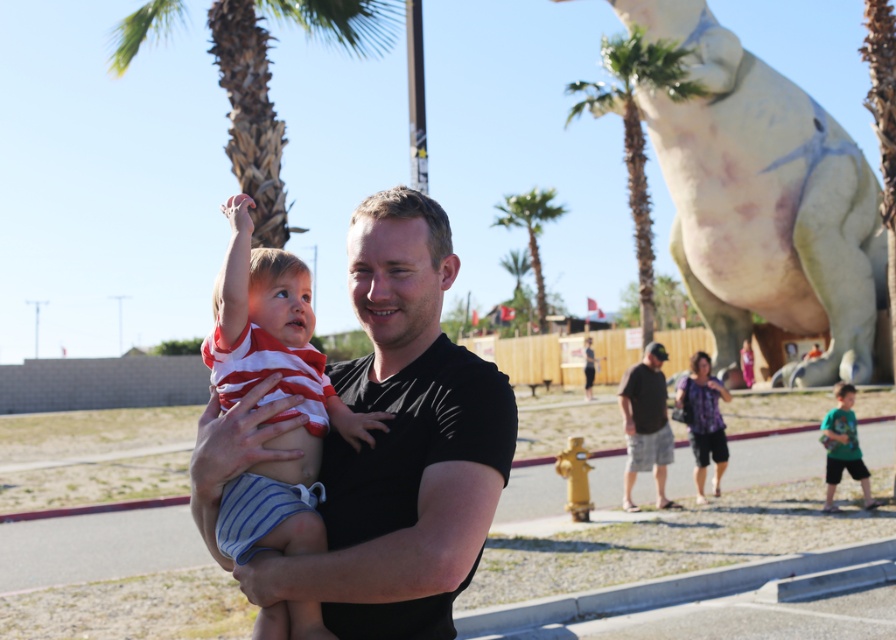
Can you confirm if green leafy palm tree at upper center is bigger than black cotton shirt at center?

Indeed, green leafy palm tree at upper center has a larger size compared to black cotton shirt at center.

In the scene shown: Between green leafy palm tree at upper center and black cotton shirt at center, which one appears on the right side from the viewer's perspective?

Positioned to the right is black cotton shirt at center.

Is point (314, 19) positioned in front of point (627, 440)?

Yes, it is in front of point (627, 440).

This screenshot has height=640, width=896. I want to click on green leafy palm tree at upper center, so click(x=268, y=88).

How distant is green leafy palm tree at upper right from green jersey at lower right?

green leafy palm tree at upper right is 27.05 meters away from green jersey at lower right.

Which is in front, point (591, 93) or point (837, 456)?

Point (837, 456) is in front.

The width and height of the screenshot is (896, 640). What are the coordinates of `green leafy palm tree at upper right` in the screenshot? It's located at (636, 129).

Looking at this image, can you confirm if green leafy palm tree at upper right is positioned below green leafy palm tree at center?

Yes.

Who is taller, green leafy palm tree at upper right or green leafy palm tree at center?

green leafy palm tree at upper right

Locate an element on the screen. green leafy palm tree at upper right is located at coordinates (636, 129).